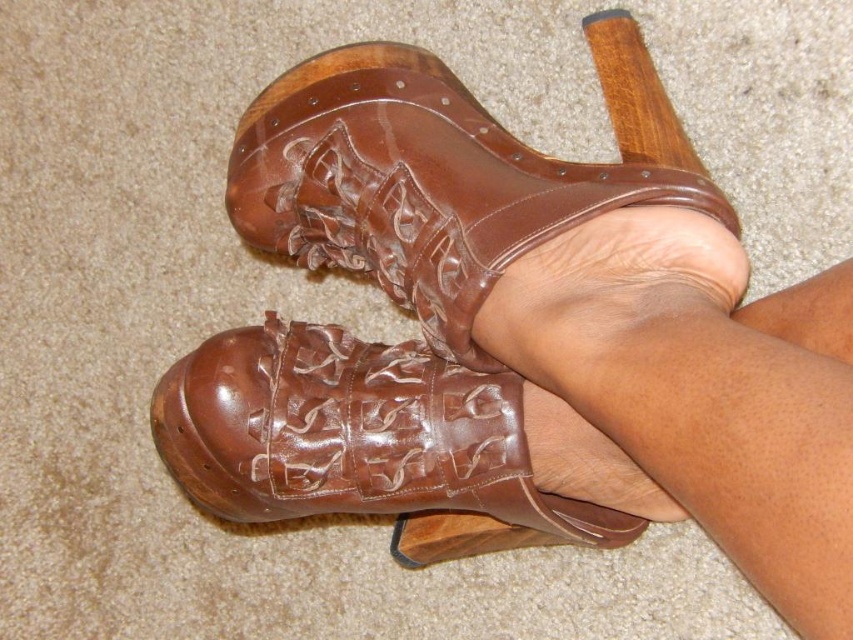
Question: Which point appears closest to the camera in this image?

Choices:
 (A) (616, 132)
 (B) (527, 163)
 (C) (321, 394)

Answer: (B)

Question: Which of the following is the closest to the observer?

Choices:
 (A) (656, 340)
 (B) (549, 541)
 (C) (341, 150)

Answer: (A)

Question: Does brown leather boot at center have a greater width compared to brown leather shoe at center?

Choices:
 (A) yes
 (B) no

Answer: (B)

Question: Which point is closer to the camera?

Choices:
 (A) brown leather boot at center
 (B) brown leather shoe at center

Answer: (A)

Question: Is shiny brown leather shoes at center positioned at the back of brown leather boot at center?

Choices:
 (A) no
 (B) yes

Answer: (A)

Question: Is shiny brown leather shoes at center to the right of brown leather boot at center from the viewer's perspective?

Choices:
 (A) yes
 (B) no

Answer: (A)